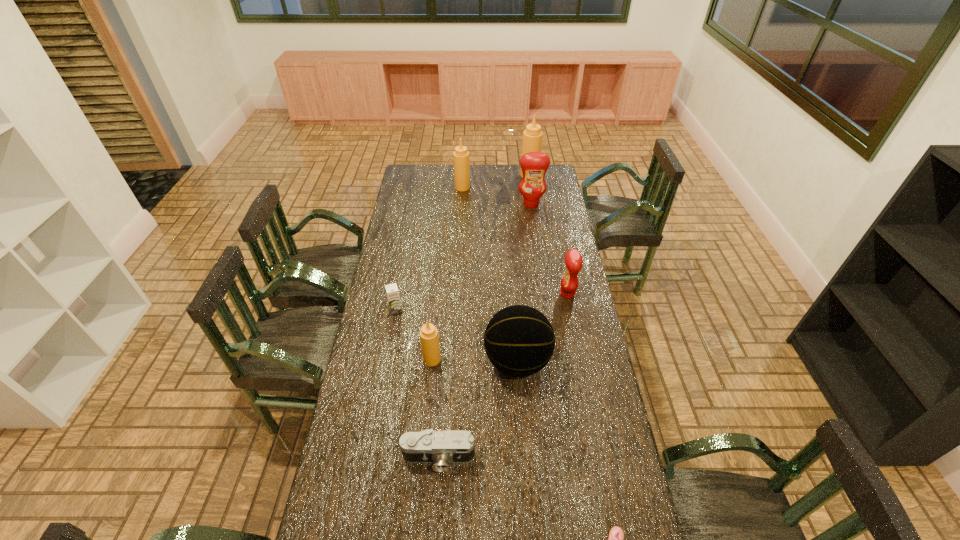
Identify the location of the biggest tan condiment. The height and width of the screenshot is (540, 960). (532, 137).

This screenshot has height=540, width=960. In order to click on the farthest condiment in this screenshot , I will do `click(532, 137)`.

Find the location of a particular element. This screenshot has width=960, height=540. the second tan condiment from left to right is located at coordinates (460, 156).

I want to click on the second smallest tan condiment, so click(460, 156).

The width and height of the screenshot is (960, 540). I want to click on the seventh nearest object, so click(534, 165).

The width and height of the screenshot is (960, 540). Identify the location of the farther red condiment. (534, 165).

Locate an element on the screen. The width and height of the screenshot is (960, 540). black basketball is located at coordinates (519, 340).

Locate an element on the screen. Image resolution: width=960 pixels, height=540 pixels. the fourth farthest object is located at coordinates (573, 260).

Identify the location of the second nearest condiment. Image resolution: width=960 pixels, height=540 pixels. (573, 260).

Image resolution: width=960 pixels, height=540 pixels. I want to click on the smallest tan condiment, so click(x=429, y=338).